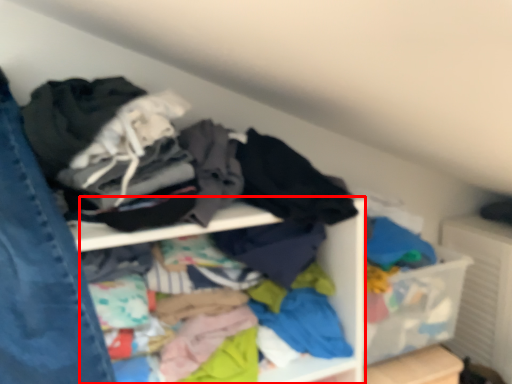
Question: From the image's perspective, where is cabinet (annotated by the red box) located in relation to jeans in the image?

Choices:
 (A) above
 (B) below

Answer: (B)